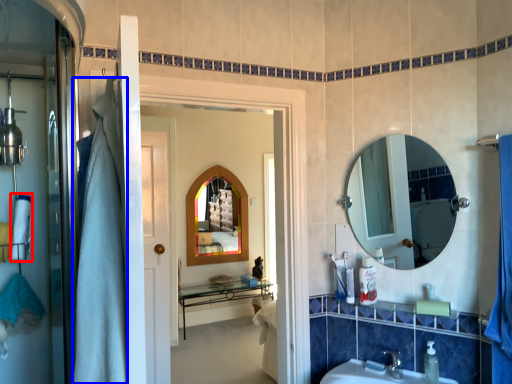
Question: Which point is further to the camera, bath towel (highlighted by a red box) or shower curtain (highlighted by a blue box)?

Choices:
 (A) bath towel
 (B) shower curtain

Answer: (A)